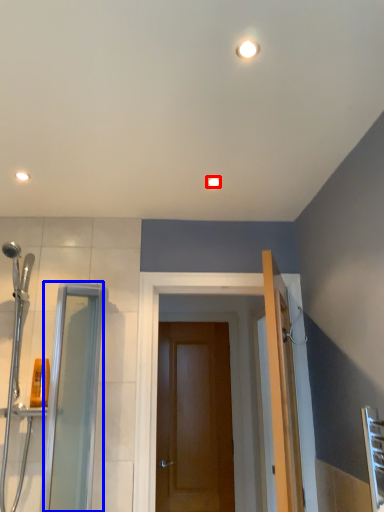
Question: Which object appears farthest to the camera in this image, light fixture (highlighted by a red box) or screen door (highlighted by a blue box)?

Choices:
 (A) light fixture
 (B) screen door

Answer: (A)